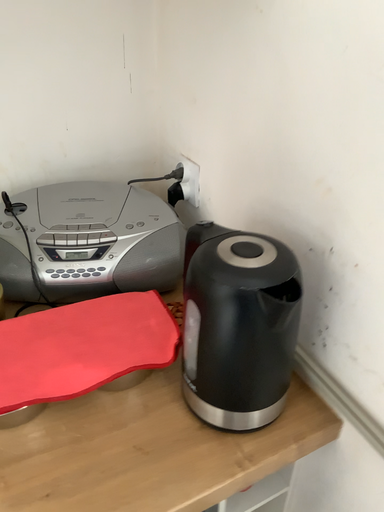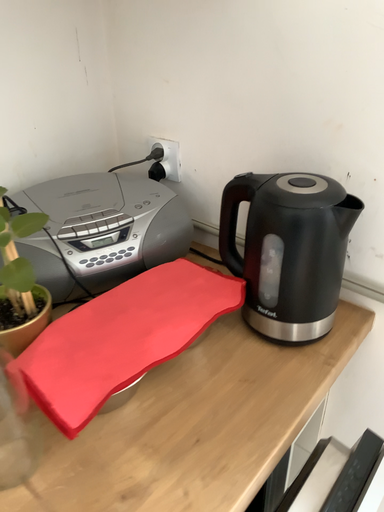
Question: How did the camera likely rotate when shooting the video?

Choices:
 (A) rotated left
 (B) rotated right

Answer: (B)